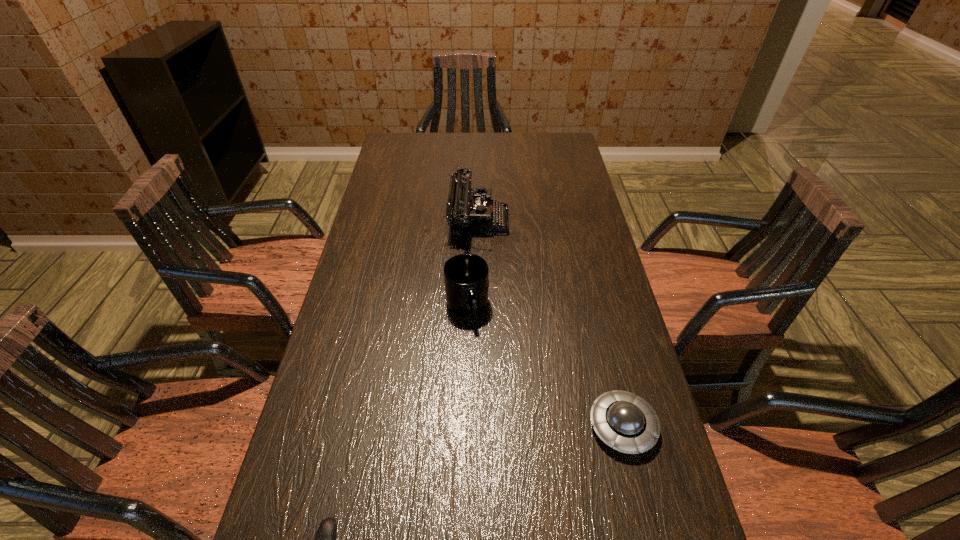
At what (x,y) coordinates should I click in order to perform the action: click on free point at the right edge. Please return your answer as a coordinate pair (x, y). The image size is (960, 540). Looking at the image, I should click on (591, 462).

In the image, there is a desktop. Where is `free space at the far left corner`? The image size is (960, 540). free space at the far left corner is located at coordinates (424, 150).

Locate an element on the screen. vacant area that lies between the second farthest object and the third tallest object is located at coordinates (545, 366).

Where is `empty space between the rightmost object and the mug`? empty space between the rightmost object and the mug is located at coordinates (545, 366).

Find the location of a particular element. The height and width of the screenshot is (540, 960). free space between the typewriter and the second nearest object is located at coordinates (550, 323).

The image size is (960, 540). Identify the location of unoccupied position between the second shortest object and the mug. (545, 366).

Locate which object is the closest to the typewriter. Please provide its 2D coordinates. Your answer should be formatted as a tuple, i.e. [(x, y)], where the tuple contains the x and y coordinates of a point satisfying the conditions above.

[(466, 280)]

Choose which object is the second nearest neighbor to the mug. Please provide its 2D coordinates. Your answer should be formatted as a tuple, i.e. [(x, y)], where the tuple contains the x and y coordinates of a point satisfying the conditions above.

[(622, 420)]

Find the location of a particular element. The width and height of the screenshot is (960, 540). vacant position in the image that satisfies the following two spatial constraints: 1. on the keyboard of the saucer; 2. on the left side of the farthest object is located at coordinates (476, 426).

Locate an element on the screen. This screenshot has height=540, width=960. free location that satisfies the following two spatial constraints: 1. on the keyboard of the second nearest object; 2. on the right side of the farthest object is located at coordinates (476, 426).